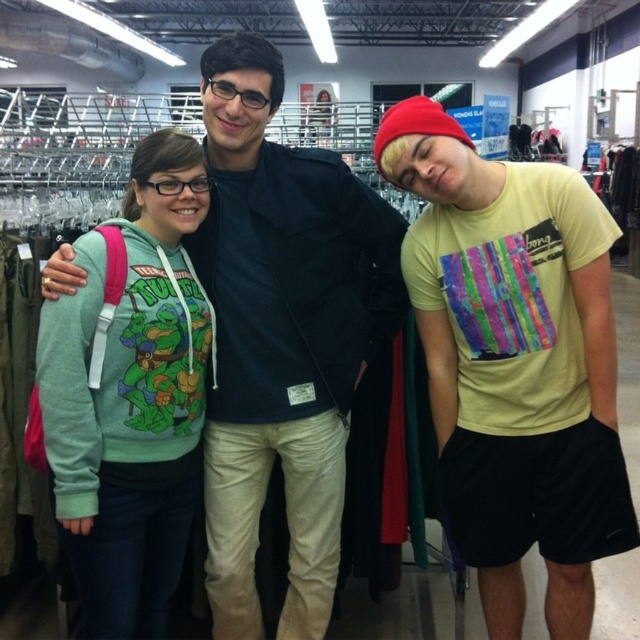
Does point (460, 529) come farther from viewer compared to point (404, 307)?

No, (460, 529) is closer to viewer.

Is point (528, 216) less distant than point (280, 372)?

Yes, point (528, 216) is closer to viewer.

I want to click on yellow matte t-shirt at center, so click(x=515, y=362).

Which is more to the left, matte black jacket at center or heather gray hoodie at left?

Positioned to the left is heather gray hoodie at left.

Does matte black jacket at center have a greater width compared to heather gray hoodie at left?

Yes.

Does point (237, 134) come in front of point (93, 426)?

No, (237, 134) is behind (93, 426).

In order to click on matte black jacket at center in this screenshot , I will do `click(282, 337)`.

Can you confirm if yellow matte t-shirt at center is positioned above heather gray hoodie at left?

Yes.

Which is more to the left, yellow matte t-shirt at center or heather gray hoodie at left?

Positioned to the left is heather gray hoodie at left.

Is point (481, 403) farther from camera compared to point (172, 337)?

Yes, it is.

In order to click on yellow matte t-shirt at center in this screenshot , I will do `click(515, 362)`.